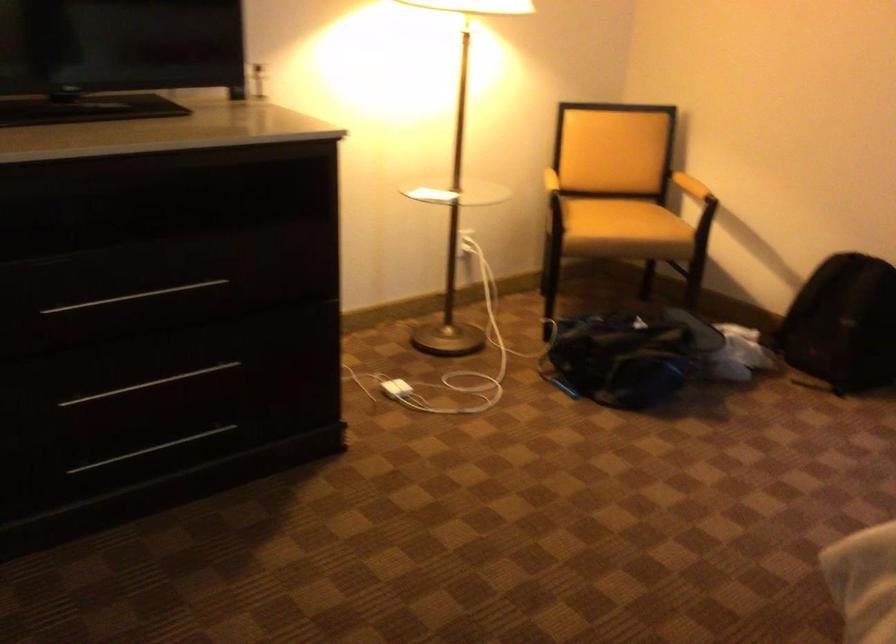
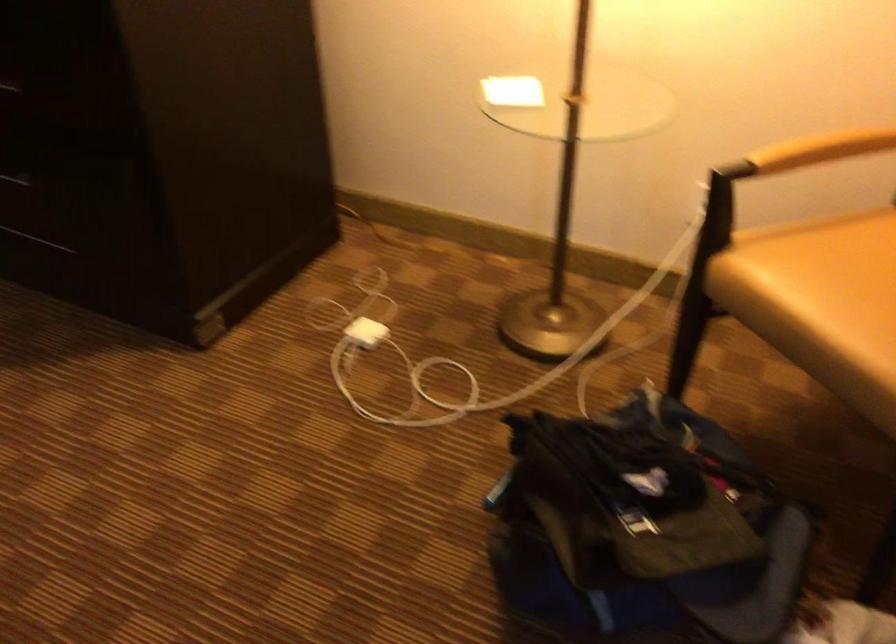
In the second image, find the point that corresponds to (555,174) in the first image.

(821, 149)